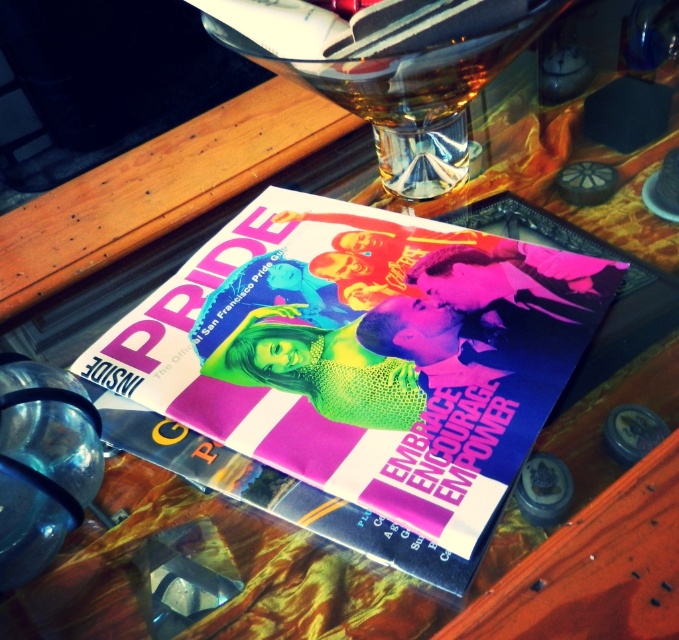
You are organizing a Pride event and need to place a name tag on the table. The name tag is the same width as the transparent plastic bottle at lower left. Can the name tag fit next to the vibrant glossy magazine at center without overlapping?

The vibrant glossy magazine at center is wider than the transparent plastic bottle at lower left. Since the name tag has the same width as the transparent plastic bottle at lower left, there should be enough space to place it next to the magazine without overlapping, provided the table has sufficient remaining space.

What is the location of the point with coordinates (365, 355) in relation to the vibrant glossy magazine at center?

The point with coordinates (365, 355) is located on the vibrant glossy magazine at center.

You are a photographer who needs to capture a closeup shot of the vibrant glossy magazine at center and the transparent plastic bottle at lower left. The camera you are using has a minimum focus distance of 3 inches. Can you focus on both objects without moving the camera?

The vibrant glossy magazine at center and transparent plastic bottle at lower left are 4.00 inches apart from each other. Since the minimum focus distance is 3 inches, the camera can focus on both objects as they are within the required distance.